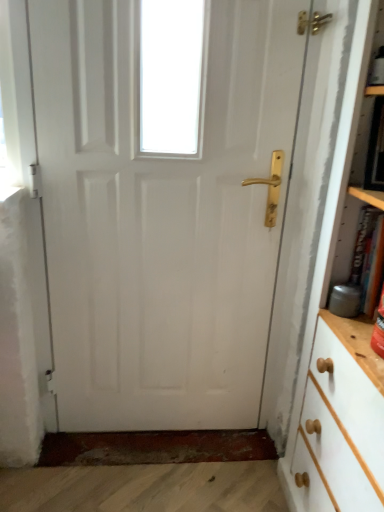
Question: Is white painted wood bookcase at right taller or shorter than white glossy door at center?

Choices:
 (A) tall
 (B) short

Answer: (B)

Question: Relative to white glossy door at center, is white painted wood bookcase at right in front or behind?

Choices:
 (A) behind
 (B) front

Answer: (B)

Question: Which is nearer to the hardcover book at right?

Choices:
 (A) white glossy door at center
 (B) white painted wood bookcase at right

Answer: (B)

Question: Based on their relative distances, which object is farther from the white painted wood bookcase at right?

Choices:
 (A) hardcover book at right
 (B) white glossy door at center

Answer: (B)